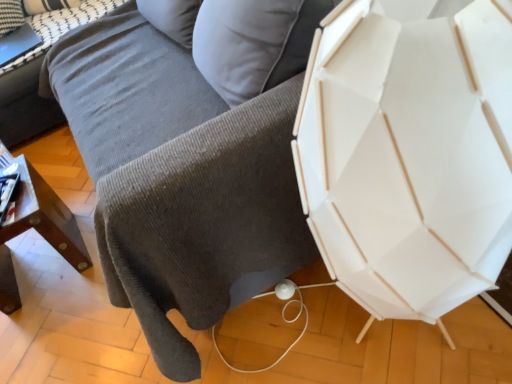
Question: Is wooden table at lower left positioned far away from gray corduroy couch at upper left?

Choices:
 (A) no
 (B) yes

Answer: (A)

Question: Does wooden table at lower left have a lesser height compared to gray corduroy couch at upper left?

Choices:
 (A) no
 (B) yes

Answer: (A)

Question: Is wooden table at lower left wider than gray corduroy couch at upper left?

Choices:
 (A) no
 (B) yes

Answer: (A)

Question: Considering the relative sizes of wooden table at lower left and gray corduroy couch at upper left in the image provided, is wooden table at lower left taller than gray corduroy couch at upper left?

Choices:
 (A) yes
 (B) no

Answer: (A)

Question: Is wooden table at lower left beside gray corduroy couch at upper left?

Choices:
 (A) no
 (B) yes

Answer: (A)

Question: Considering the relative positions of wooden table at lower left and gray corduroy couch at upper left in the image provided, is wooden table at lower left to the left of gray corduroy couch at upper left from the viewer's perspective?

Choices:
 (A) no
 (B) yes

Answer: (A)

Question: Does wooden table at lower left lie in front of white textured pillow at upper left?

Choices:
 (A) yes
 (B) no

Answer: (A)

Question: Does wooden table at lower left have a greater height compared to white textured pillow at upper left?

Choices:
 (A) yes
 (B) no

Answer: (A)

Question: Is white textured pillow at upper left completely or partially inside wooden table at lower left?

Choices:
 (A) no
 (B) yes

Answer: (A)

Question: Is wooden table at lower left positioned beyond the bounds of white textured pillow at upper left?

Choices:
 (A) no
 (B) yes

Answer: (B)

Question: Considering the relative positions of wooden table at lower left and white textured pillow at upper left in the image provided, is wooden table at lower left to the left of white textured pillow at upper left from the viewer's perspective?

Choices:
 (A) no
 (B) yes

Answer: (A)

Question: Is wooden table at lower left positioned behind white textured pillow at upper left?

Choices:
 (A) no
 (B) yes

Answer: (A)

Question: Does white textured pillow at upper left have a greater width compared to gray corduroy couch at upper left?

Choices:
 (A) yes
 (B) no

Answer: (B)